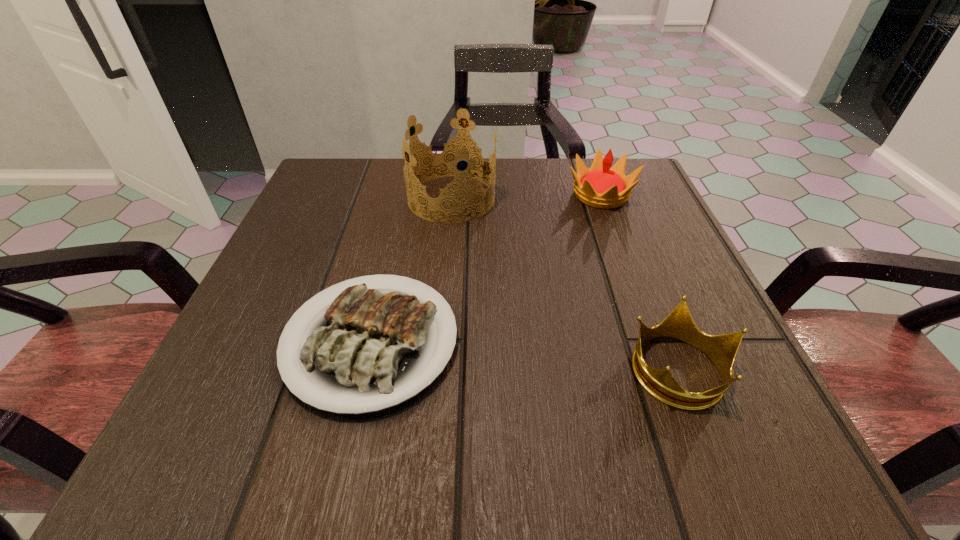
Where is `vacant area that lies between the plate and the leftmost crown`? This screenshot has height=540, width=960. vacant area that lies between the plate and the leftmost crown is located at coordinates (411, 270).

Identify the location of vacant area that lies between the third tallest object and the shortest object. The image size is (960, 540). (525, 355).

The image size is (960, 540). What are the coordinates of `object that is the second closest to the leftmost crown` in the screenshot? It's located at (601, 186).

You are a GUI agent. You are given a task and a screenshot of the screen. Output one action in this format:
    pyautogui.click(x=<x>, y=<y>)
    Task: Click on the second closest object to the second shortest crown
    
    Given the screenshot: What is the action you would take?
    pyautogui.click(x=364, y=354)

The width and height of the screenshot is (960, 540). Identify the location of crown identified as the closest to the leftmost crown. (601, 186).

At what (x,y) coordinates should I click in order to perform the action: click on crown identified as the second closest to the second tallest object. Please return your answer as a coordinate pair (x, y). This screenshot has height=540, width=960. Looking at the image, I should click on (679, 325).

Identify the location of vacant point that satisfies the following two spatial constraints: 1. on the front side of the third tallest object; 2. on the left side of the tallest object. (437, 369).

You are a GUI agent. You are given a task and a screenshot of the screen. Output one action in this format:
    pyautogui.click(x=<x>, y=<y>)
    Task: Click on the free space that satisfies the following two spatial constraints: 1. on the back side of the leftmost crown; 2. on the left side of the third shortest object
    
    Given the screenshot: What is the action you would take?
    pyautogui.click(x=452, y=194)